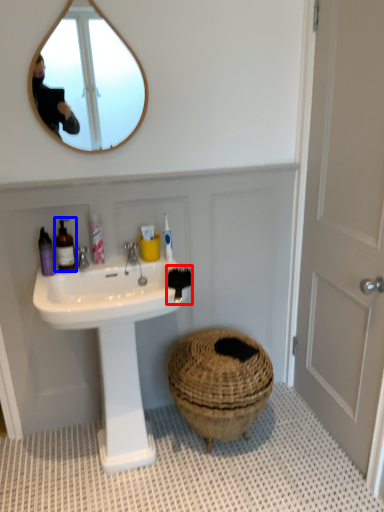
Question: Which of the following is the closest to the observer, brush (highlighted by a red box) or toiletry (highlighted by a blue box)?

Choices:
 (A) brush
 (B) toiletry

Answer: (A)